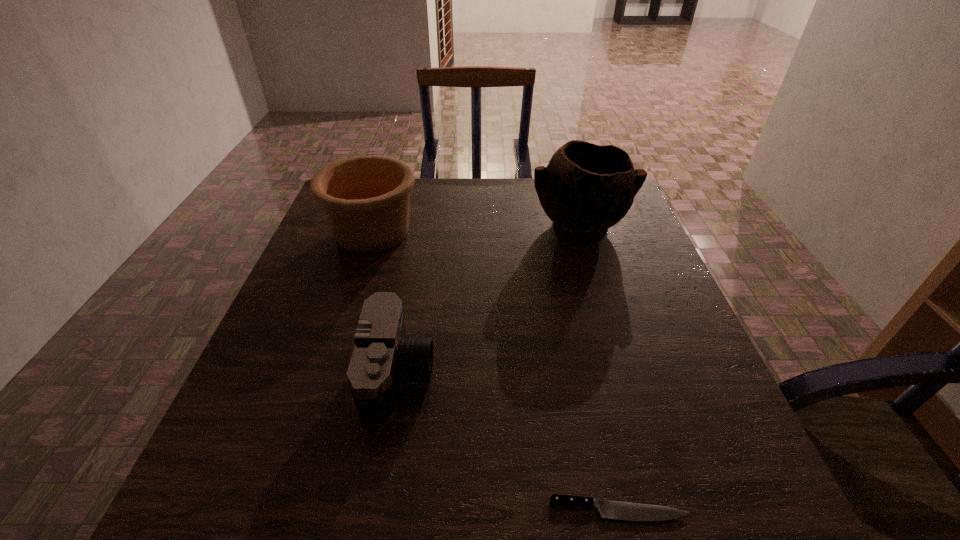
Locate an element on the screen. This screenshot has height=540, width=960. vacant space located on the front-facing side of the camera is located at coordinates (470, 376).

At what (x,y) coordinates should I click in order to perform the action: click on vacant space located on the left of the shortest object. Please return your answer as a coordinate pair (x, y). The height and width of the screenshot is (540, 960). Looking at the image, I should click on (396, 510).

This screenshot has width=960, height=540. What are the coordinates of `object present at the near edge` in the screenshot? It's located at (615, 510).

Find the location of a particular element. The height and width of the screenshot is (540, 960). object located at the left edge is located at coordinates (365, 199).

Locate an element on the screen. This screenshot has height=540, width=960. pottery at the right edge is located at coordinates (585, 189).

I want to click on steak knife that is at the right edge, so click(x=615, y=510).

Locate an element on the screen. This screenshot has height=540, width=960. object that is at the far left corner is located at coordinates (365, 199).

Find the location of `object at the far right corner`. object at the far right corner is located at coordinates (585, 189).

Locate an element on the screen. object at the near right corner is located at coordinates (615, 510).

What are the coordinates of `vacant space at the far edge of the desktop` in the screenshot? It's located at (489, 198).